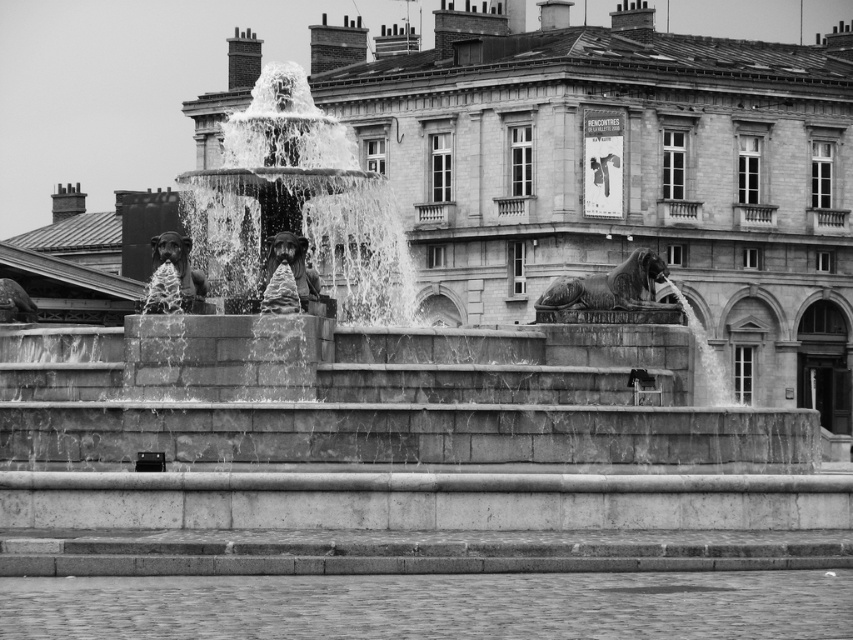
Question: Does bronze lion at center appear over polished bronze statue at center?

Choices:
 (A) yes
 (B) no

Answer: (A)

Question: Which of these objects is positioned closest to the polished bronze statue at center?

Choices:
 (A) bronze statue at left
 (B) polished bronze lion at center

Answer: (B)

Question: Does polished bronze lion at center have a smaller size compared to polished bronze statue at center?

Choices:
 (A) yes
 (B) no

Answer: (B)

Question: Which of the following is the closest to the observer?

Choices:
 (A) polished bronze lion at center
 (B) bronze statue at left
 (C) polished bronze statue at center
 (D) bronze lion at center

Answer: (C)

Question: Is bronze lion at center behind bronze statue at left?

Choices:
 (A) no
 (B) yes

Answer: (A)

Question: Which of these objects is positioned closest to the bronze statue at left?

Choices:
 (A) polished bronze lion at center
 (B) polished bronze statue at center

Answer: (B)